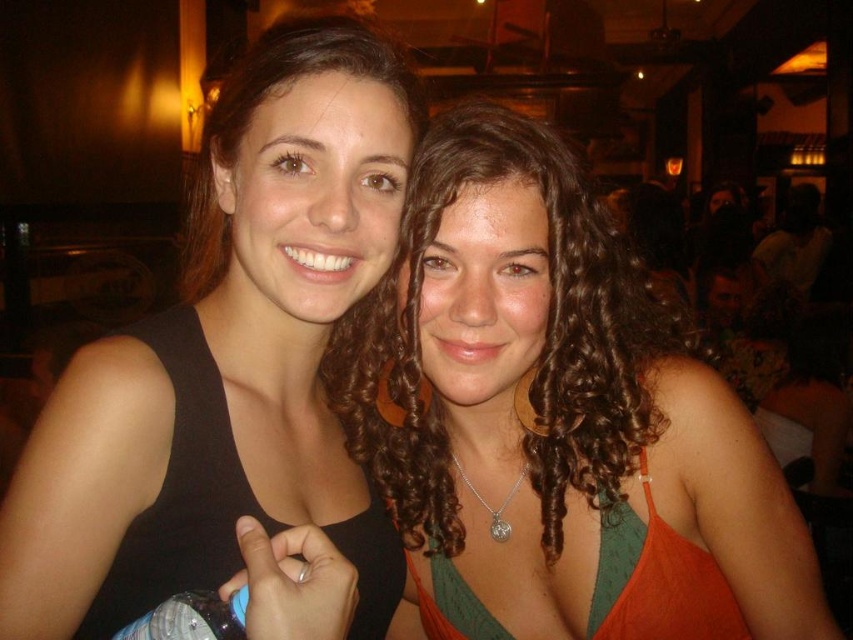
Locate an element on the screen. Image resolution: width=853 pixels, height=640 pixels. black matte tank top at left is located at coordinates (228, 362).

Can you confirm if black matte tank top at left is thinner than curly hair at center?

Yes, black matte tank top at left is thinner than curly hair at center.

Is point (172, 545) positioned behind point (560, 426)?

No, it is in front of (560, 426).

You are a GUI agent. You are given a task and a screenshot of the screen. Output one action in this format:
    pyautogui.click(x=<x>, y=<y>)
    Task: Click on the black matte tank top at left
    The height and width of the screenshot is (640, 853).
    Given the screenshot: What is the action you would take?
    pyautogui.click(x=228, y=362)